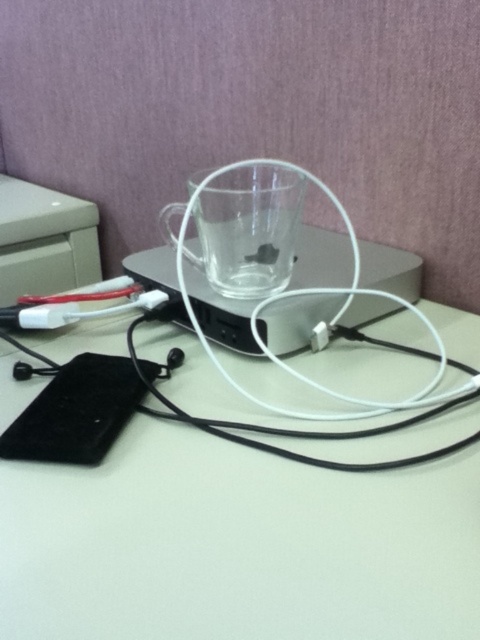
Is white matte table at lower center bigger than black rubber earphone at lower center?

Yes.

Measure the distance from white matte table at lower center to black rubber earphone at lower center.

white matte table at lower center and black rubber earphone at lower center are 7.83 inches apart.

What do you see at coordinates (236, 545) in the screenshot?
I see `white matte table at lower center` at bounding box center [236, 545].

Where is `white matte table at lower center`? Image resolution: width=480 pixels, height=640 pixels. white matte table at lower center is located at coordinates (236, 545).